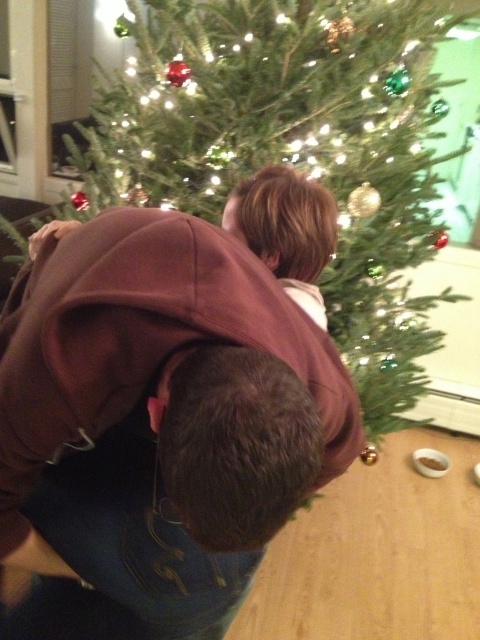
Question: Is brown hoodie at center above green matte christmas tree at center?

Choices:
 (A) yes
 (B) no

Answer: (B)

Question: Among these objects, which one is farthest from the camera?

Choices:
 (A) green matte christmas tree at center
 (B) brown hoodie at center

Answer: (A)

Question: Which point appears farthest from the camera in this image?

Choices:
 (A) (374, 436)
 (B) (111, 224)

Answer: (A)

Question: From the image, what is the correct spatial relationship of brown hoodie at center in relation to green matte christmas tree at center?

Choices:
 (A) above
 (B) below

Answer: (B)

Question: Can you confirm if brown hoodie at center is wider than green matte christmas tree at center?

Choices:
 (A) yes
 (B) no

Answer: (B)